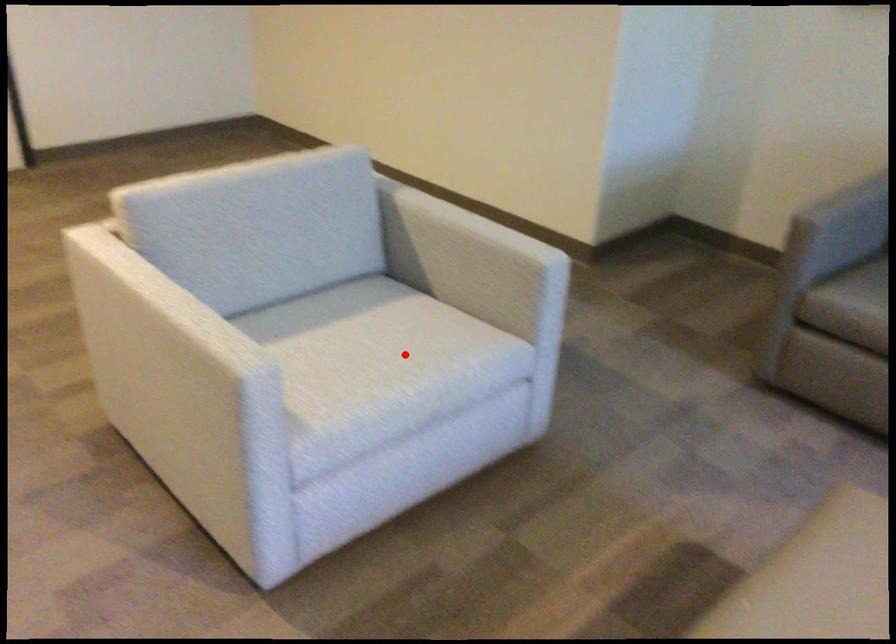
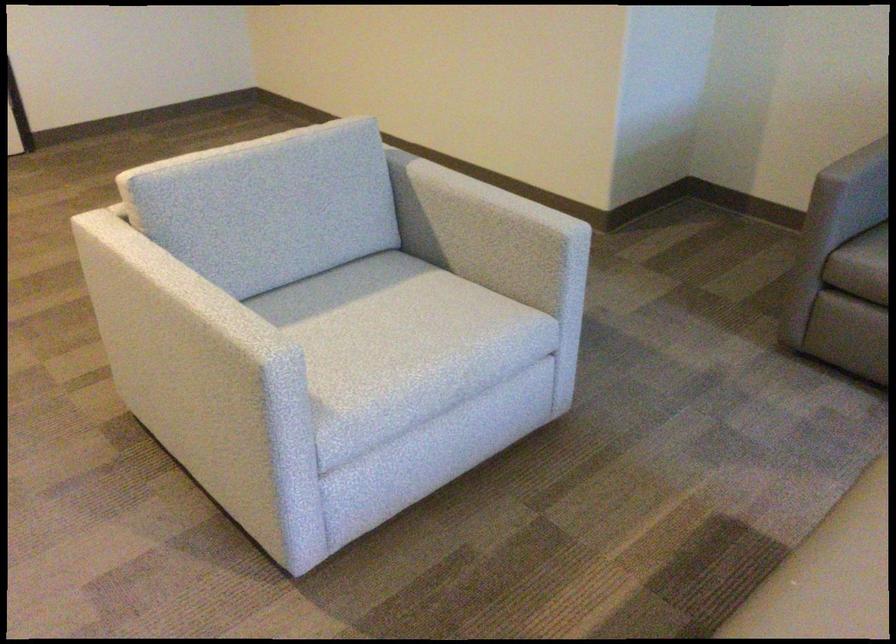
Question: I am providing you with two images of the same scene from different viewpoints. A red point is marked on the first image. Is the red point's position out of view in image 2?

Choices:
 (A) Yes
 (B) No

Answer: (B)